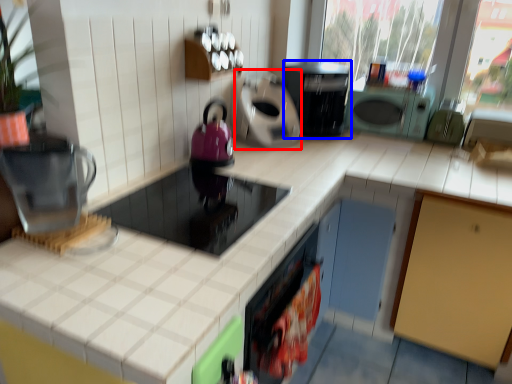
Question: Which object appears farthest to the camera in this image, appliance (highlighted by a red box) or home appliance (highlighted by a blue box)?

Choices:
 (A) appliance
 (B) home appliance

Answer: (B)